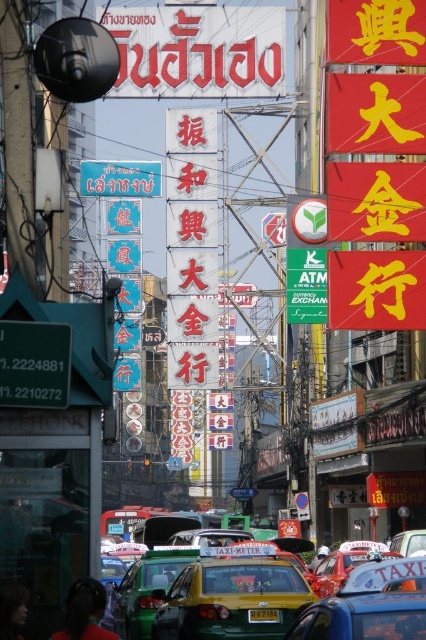
Looking at this image, you are a delivery driver navigating through this busy street. You need to deliver a package to a location marked by point [204,266] and then to another location marked by point [195,536]. Based on the scene description, which point should you visit first to follow the correct delivery route?

You should visit point [195,536] first because point [204,266] is behind it, so reaching the front point first ensures you can proceed to the one behind without backtracking.